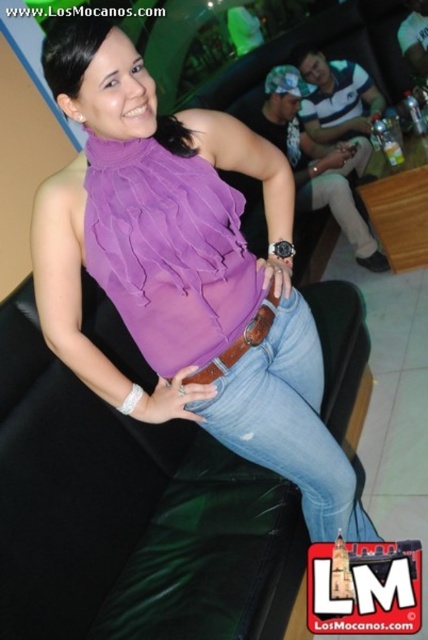
Which is more to the left, jeans at center or brown leather belt at center?

From the viewer's perspective, brown leather belt at center appears more on the left side.

Does point (279, 456) come in front of point (270, 291)?

That is True.

Image resolution: width=428 pixels, height=640 pixels. I want to click on jeans at center, so click(x=288, y=422).

How much distance is there between purple chiffon blouse at center and brown leather belt at center?

9.99 inches

This screenshot has height=640, width=428. Identify the location of purple chiffon blouse at center. (183, 269).

Does purple chiffon blouse at center appear on the left side of jeans at center?

Indeed, purple chiffon blouse at center is positioned on the left side of jeans at center.

Is purple chiffon blouse at center taller than jeans at center?

Yes.

Based on the photo, who is more distant from viewer, (131, 156) or (300, 362)?

Positioned behind is point (300, 362).

The image size is (428, 640). What are the coordinates of `purple chiffon blouse at center` in the screenshot? It's located at (183, 269).